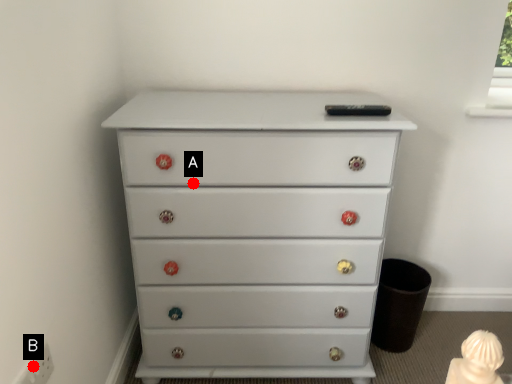
Question: Two points are circled on the image, labeled by A and B beside each circle. Which point is closer to the camera?

Choices:
 (A) A is closer
 (B) B is closer

Answer: (B)